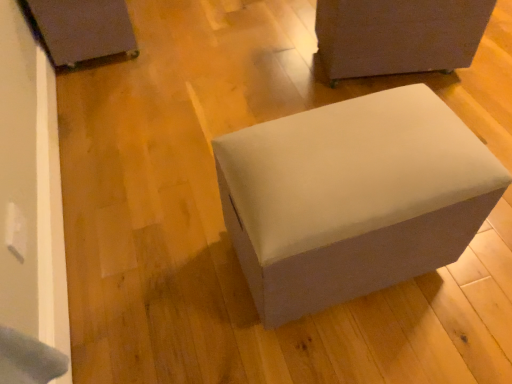
The image size is (512, 384). What are the coordinates of `free space above suede-like gray ottoman at center, placed as the 2th furniture when sorted from right to left (from a real-world perspective)` in the screenshot? It's located at (353, 139).